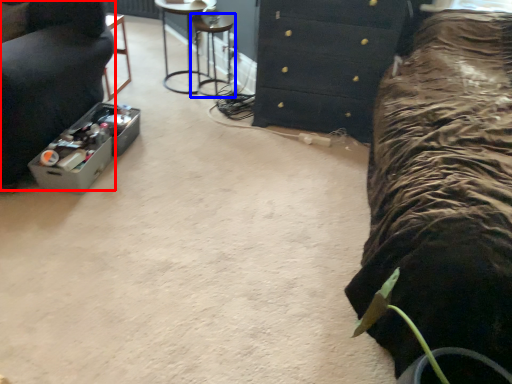
Question: Among these objects, which one is farthest to the camera, furniture (highlighted by a red box) or bar stool (highlighted by a blue box)?

Choices:
 (A) furniture
 (B) bar stool

Answer: (B)